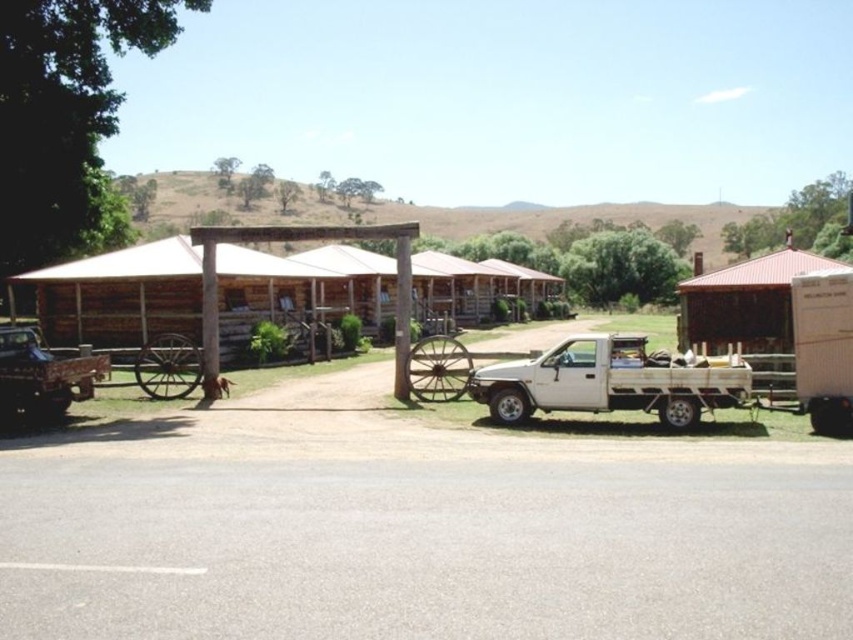
Question: Can you confirm if brown wooden hut at center is positioned below rustic wooden hut at right?

Choices:
 (A) no
 (B) yes

Answer: (B)

Question: Can you confirm if white matte truck at center is positioned below white matte truck at right?

Choices:
 (A) yes
 (B) no

Answer: (A)

Question: Does white matte truck at right have a greater width compared to brushed metal truck at left?

Choices:
 (A) yes
 (B) no

Answer: (A)

Question: Which object is farther from the camera taking this photo?

Choices:
 (A) white matte truck at center
 (B) brown wooden hut at center

Answer: (B)

Question: Based on their relative distances, which object is nearer to the rustic wooden hut at right?

Choices:
 (A) brushed metal truck at left
 (B) white matte truck at center
 (C) white matte truck at right
 (D) brown wooden hut at center

Answer: (C)

Question: Which of the following is the closest to the observer?

Choices:
 (A) white matte truck at center
 (B) brown wooden hut at center

Answer: (A)